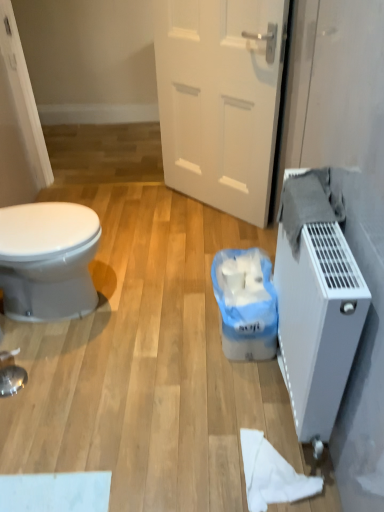
What are the coordinates of `vacant space behind white matte toilet paper at lower right` in the screenshot? It's located at (248, 402).